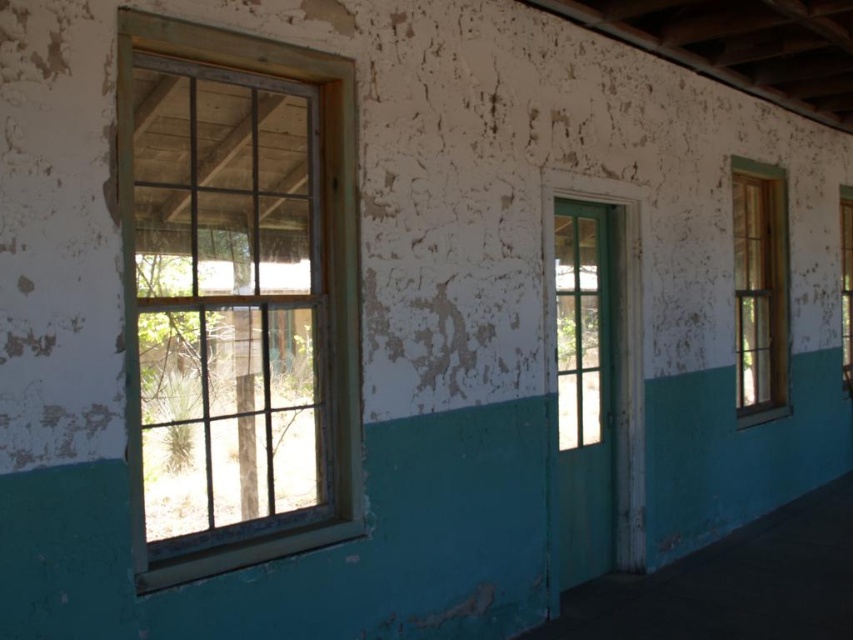
You are an interior designer assessing the space for potential renovations. You need to decide whether to replace the wooden frame window at right or the green matte glass door at center based on their sizes. Which one has a larger surface area?

The wooden frame window at right has a larger surface area than the green matte glass door at center according to the description provided.

You are an interior designer planning to install a new window in the space. You have two options based on the existing windows in the scene. Which window has a greater width between the wooden frame window at right and the clear glass window at right?

The wooden frame window at right is wider than the clear glass window at right according to the description.